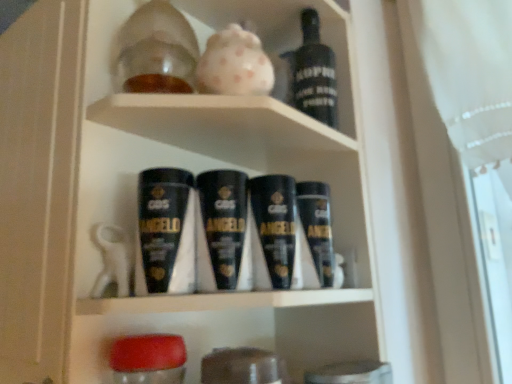
Question: Is black matte bottle at upper center touching black matte shaving cream at center?

Choices:
 (A) no
 (B) yes

Answer: (A)

Question: Would you say black matte bottle at upper center contains black matte shaving cream at center?

Choices:
 (A) yes
 (B) no

Answer: (B)

Question: Would you say black matte bottle at upper center is outside black matte shaving cream at center?

Choices:
 (A) no
 (B) yes

Answer: (B)

Question: From a real-world perspective, is black matte bottle at upper center located higher than black matte shaving cream at center?

Choices:
 (A) yes
 (B) no

Answer: (A)

Question: Does black matte bottle at upper center appear on the left side of black matte shaving cream at center?

Choices:
 (A) yes
 (B) no

Answer: (B)

Question: From the image's perspective, is black matte bottle at upper center below black matte shaving cream at center?

Choices:
 (A) yes
 (B) no

Answer: (B)

Question: Is translucent glass jar at upper center surrounded by black matte bottle at upper center?

Choices:
 (A) no
 (B) yes

Answer: (A)

Question: Is black matte bottle at upper center bigger than translucent glass jar at upper center?

Choices:
 (A) yes
 (B) no

Answer: (B)

Question: Is black matte bottle at upper center shorter than translucent glass jar at upper center?

Choices:
 (A) yes
 (B) no

Answer: (B)

Question: From the image's perspective, is black matte bottle at upper center above translucent glass jar at upper center?

Choices:
 (A) no
 (B) yes

Answer: (A)

Question: From a real-world perspective, is black matte bottle at upper center over translucent glass jar at upper center?

Choices:
 (A) no
 (B) yes

Answer: (B)

Question: Is black matte bottle at upper center outside of translucent glass jar at upper center?

Choices:
 (A) no
 (B) yes

Answer: (B)

Question: Can you confirm if translucent glass jar at upper center is thinner than black matte bottle at upper center?

Choices:
 (A) no
 (B) yes

Answer: (A)